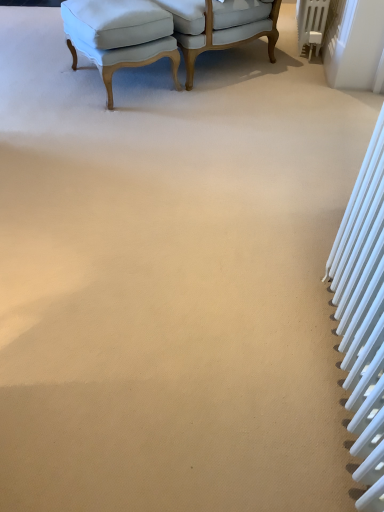
You are a GUI agent. You are given a task and a screenshot of the screen. Output one action in this format:
    pyautogui.click(x=<x>, y=<y>)
    Task: Click on the vacant space positioned to the left of white metallic radiator at right, the first radiator from the bottom
    Image resolution: width=384 pixels, height=512 pixels.
    Given the screenshot: What is the action you would take?
    pyautogui.click(x=205, y=364)